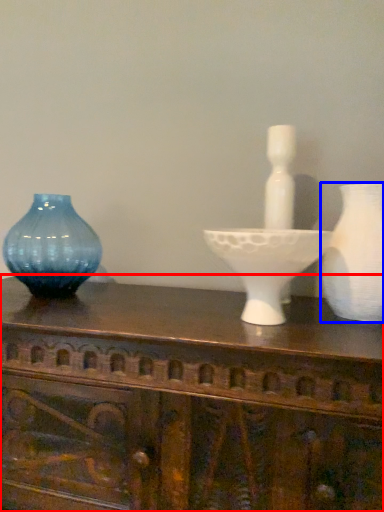
Question: Which of the following is the closest to the observer, table (highlighted by a red box) or vase (highlighted by a blue box)?

Choices:
 (A) table
 (B) vase

Answer: (A)